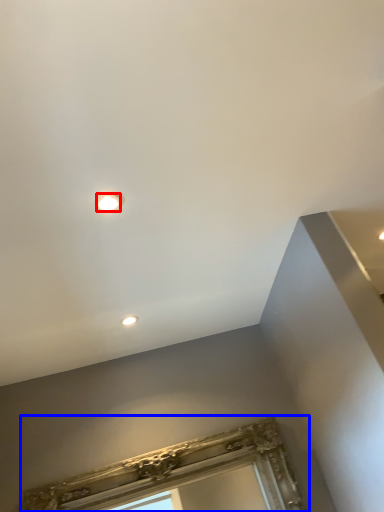
Question: Which object appears closest to the camera in this image, droplight (highlighted by a red box) or window frame (highlighted by a blue box)?

Choices:
 (A) droplight
 (B) window frame

Answer: (A)